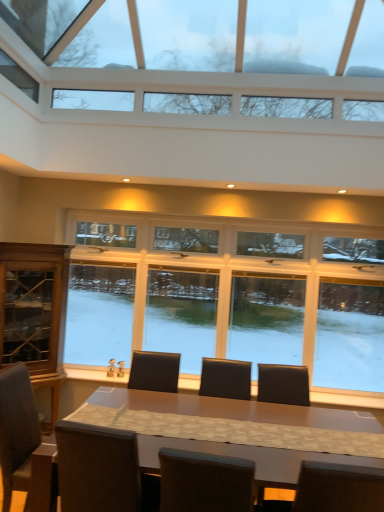
In order to face dark brown leather chair at lower left, should I rotate leftwards or rightwards?

Turn left by 19.081 degrees to look at dark brown leather chair at lower left.

Find the location of a particular element. Image resolution: width=384 pixels, height=512 pixels. clear glass windows at upper center, which is counted as the first window, starting from the front is located at coordinates pos(206,35).

At what (x,y) coordinates should I click in order to perform the action: click on table lying behind the clear glass windows at upper center, which is counted as the 2th window, starting from the bottom. Please return your answer as a coordinate pair (x, y). The image size is (384, 512). Looking at the image, I should click on (237, 410).

Does point (145, 399) lie behind point (202, 40)?

That is False.

From the picture: Who is bigger, matte brown table at center or clear glass windows at upper center, which is counted as the 2th window, starting from the bottom?

clear glass windows at upper center, which is counted as the 2th window, starting from the bottom.

Considering the positions of objects matte brown table at center and clear glass windows at upper center, which is the 1th window from top to bottom, in the image provided, who is more to the right, matte brown table at center or clear glass windows at upper center, which is the 1th window from top to bottom,?

matte brown table at center.

Which object is closer to the camera taking this photo, matte brown table at center or dark brown leather armchair at center?

matte brown table at center is more forward.

How different are the orientations of matte brown table at center and dark brown leather armchair at center in degrees?

There is a 6.98-degree angle between the facing directions of matte brown table at center and dark brown leather armchair at center.

From the image's perspective, which is above, matte brown table at center or dark brown leather armchair at center?

dark brown leather armchair at center, from the image's perspective.

Between point (191, 399) and point (306, 388), which one is positioned in front?

The point (191, 399) is more forward.

Identify the location of chair below the clear glass windows at upper center, which is the 1th window from top to bottom (from a real-world perspective). (17, 430).

Could dark brown leather chair at lower left be considered to be inside clear glass windows at upper center, which is counted as the 2th window, starting from the bottom?

No, dark brown leather chair at lower left is not surrounded by clear glass windows at upper center, which is counted as the 2th window, starting from the bottom.

Is clear glass windows at upper center, which is counted as the 2th window, starting from the bottom, facing towards dark brown leather chair at lower left?

No, clear glass windows at upper center, which is counted as the 2th window, starting from the bottom, is not aimed at dark brown leather chair at lower left.

Which of these two, clear glass windows at upper center, which is counted as the 2th window, starting from the bottom, or dark brown leather chair at lower left, is smaller?

With smaller size is dark brown leather chair at lower left.

Based on their sizes in the image, would you say dark brown leather armchair at center is bigger or smaller than clear glass windows at center, the 1th window from the bottom?

Clearly, dark brown leather armchair at center is smaller in size than clear glass windows at center, the 1th window from the bottom.

Is dark brown leather armchair at center in front of or behind clear glass windows at center, the second window from the top, in the image?

In the image, dark brown leather armchair at center appears in front of clear glass windows at center, the second window from the top.

Is dark brown leather armchair at center to the right of clear glass windows at center, marked as the 2th window in a front-to-back arrangement, from the viewer's perspective?

Indeed, dark brown leather armchair at center is positioned on the right side of clear glass windows at center, marked as the 2th window in a front-to-back arrangement.

Considering the relative sizes of dark brown leather chair at lower left and dark brown leather armchair at center in the image provided, is dark brown leather chair at lower left shorter than dark brown leather armchair at center?

No.

Does point (37, 414) lie in front of point (258, 375)?

Yes, point (37, 414) is in front of point (258, 375).

Would you say dark brown leather chair at lower left is to the left or to the right of dark brown leather armchair at center in the picture?

Based on their positions, dark brown leather chair at lower left is located to the left of dark brown leather armchair at center.

Which object is thinner, dark brown leather chair at lower left or dark brown leather armchair at center?

dark brown leather armchair at center is thinner.

I want to click on window on the left side of clear glass windows at center, marked as the 2th window in a front-to-back arrangement, so click(x=206, y=35).

Is clear glass windows at upper center, which is counted as the 2th window, starting from the bottom, inside the boundaries of clear glass windows at center, the second window from the top, or outside?

clear glass windows at upper center, which is counted as the 2th window, starting from the bottom, is not enclosed by clear glass windows at center, the second window from the top.

Consider the image. Is clear glass windows at upper center, marked as the 2th window in a back-to-front arrangement, with clear glass windows at center, the first window when ordered from back to front?

No, clear glass windows at upper center, marked as the 2th window in a back-to-front arrangement, is not with clear glass windows at center, the first window when ordered from back to front.

From a real-world perspective, is clear glass windows at upper center, which is counted as the 2th window, starting from the bottom, beneath clear glass windows at center, the 1th window from the bottom?

No, from a real-world perspective, clear glass windows at upper center, which is counted as the 2th window, starting from the bottom, is not under clear glass windows at center, the 1th window from the bottom.

Considering the sizes of objects clear glass windows at center, marked as the 2th window in a front-to-back arrangement, and clear glass windows at upper center, which is counted as the first window, starting from the front, in the image provided, who is taller, clear glass windows at center, marked as the 2th window in a front-to-back arrangement, or clear glass windows at upper center, which is counted as the first window, starting from the front,?

With more height is clear glass windows at center, marked as the 2th window in a front-to-back arrangement.

How different are the orientations of clear glass windows at center, marked as the 2th window in a front-to-back arrangement, and clear glass windows at upper center, which is counted as the first window, starting from the front, in degrees?

They differ by 89.2 degrees in their facing directions.

Image resolution: width=384 pixels, height=512 pixels. Identify the location of window below the clear glass windows at upper center, marked as the 2th window in a back-to-front arrangement (from the image's perspective). (248, 292).

Is clear glass windows at center, the 1th window from the bottom, outside of clear glass windows at upper center, marked as the 2th window in a back-to-front arrangement?

clear glass windows at center, the 1th window from the bottom, lies outside clear glass windows at upper center, marked as the 2th window in a back-to-front arrangement,'s area.

The height and width of the screenshot is (512, 384). Find the location of `the 2nd window directly above the matte brown table at center (from a real-world perspective)`. the 2nd window directly above the matte brown table at center (from a real-world perspective) is located at coordinates (206, 35).

Where is `armchair on the right of matte brown table at center`? armchair on the right of matte brown table at center is located at coordinates (283, 384).

Looking at the image, which one is located further to dark brown leather armchair at center, matte brown table at center or clear glass windows at upper center, marked as the 2th window in a back-to-front arrangement?

clear glass windows at upper center, marked as the 2th window in a back-to-front arrangement, is further to dark brown leather armchair at center.

Considering their positions, is dark brown leather armchair at center positioned closer to clear glass windows at center, marked as the 2th window in a front-to-back arrangement, than matte brown table at center?

Based on the image, dark brown leather armchair at center appears to be nearer to clear glass windows at center, marked as the 2th window in a front-to-back arrangement.

Considering their positions, is clear glass windows at center, marked as the 2th window in a front-to-back arrangement, positioned further to clear glass windows at upper center, which is the 1th window from top to bottom, than matte brown table at center?

The object further to clear glass windows at upper center, which is the 1th window from top to bottom, is matte brown table at center.

From the image, which object appears to be farther from clear glass windows at upper center, marked as the 2th window in a back-to-front arrangement, dark brown leather armchair at center or clear glass windows at center, marked as the 2th window in a front-to-back arrangement?

Among the two, dark brown leather armchair at center is located further to clear glass windows at upper center, marked as the 2th window in a back-to-front arrangement.

When comparing their distances from matte brown table at center, does dark brown leather chair at lower left or clear glass windows at center, the second window from the top, seem further?

clear glass windows at center, the second window from the top.

When comparing their distances from matte brown table at center, does dark brown leather armchair at center or dark brown leather chair at lower left seem closer?

A: dark brown leather armchair at center lies closer to matte brown table at center than the other object.

When comparing their distances from matte brown table at center, does clear glass windows at center, marked as the 2th window in a front-to-back arrangement, or dark brown leather armchair at center seem further?

Among the two, clear glass windows at center, marked as the 2th window in a front-to-back arrangement, is located further to matte brown table at center.

Considering their positions, is dark brown leather armchair at center positioned further to clear glass windows at upper center, which is counted as the first window, starting from the front, than matte brown table at center?

Among the two, matte brown table at center is located further to clear glass windows at upper center, which is counted as the first window, starting from the front.

Where is `chair between matte brown table at center and clear glass windows at center, the first window when ordered from back to front, from front to back`? This screenshot has width=384, height=512. chair between matte brown table at center and clear glass windows at center, the first window when ordered from back to front, from front to back is located at coordinates (17, 430).

Image resolution: width=384 pixels, height=512 pixels. I want to click on table located between dark brown leather chair at lower left and dark brown leather armchair at center in the left-right direction, so click(237, 410).

Locate an element on the screen. window between clear glass windows at upper center, which is counted as the 2th window, starting from the bottom, and dark brown leather chair at lower left in the up-down direction is located at coordinates (248, 292).

At what (x,y) coordinates should I click in order to perform the action: click on armchair positioned between matte brown table at center and clear glass windows at center, the second window from the top, from near to far. Please return your answer as a coordinate pair (x, y). This screenshot has width=384, height=512. Looking at the image, I should click on [x=283, y=384].